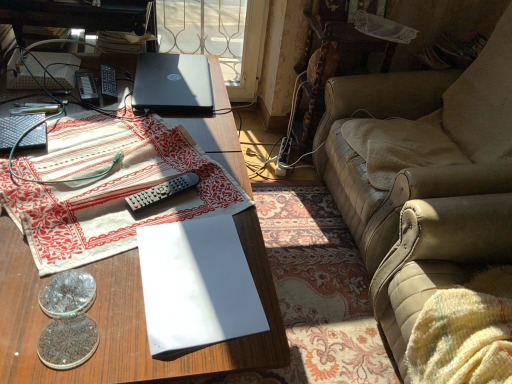
At what (x,y) coordinates should I click in order to perform the action: click on free space between white paper at center, the second paperback book when ordered from back to front, and shiny metallic coin at lower left, placed as the 1th coin when sorted from back to front. Please return your answer as a coordinate pair (x, y). The image size is (512, 384). Looking at the image, I should click on coord(116,284).